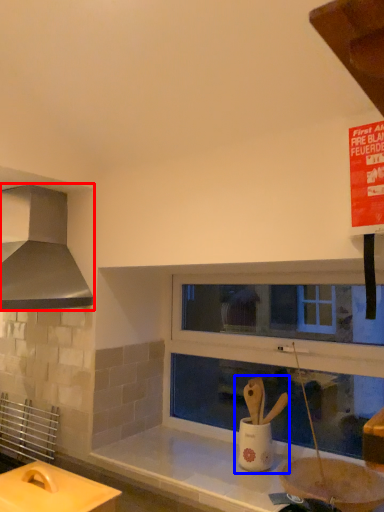
Question: Which object is closer to the camera taking this photo, kitchen appliance (highlighted by a red box) or sink (highlighted by a blue box)?

Choices:
 (A) kitchen appliance
 (B) sink

Answer: (A)